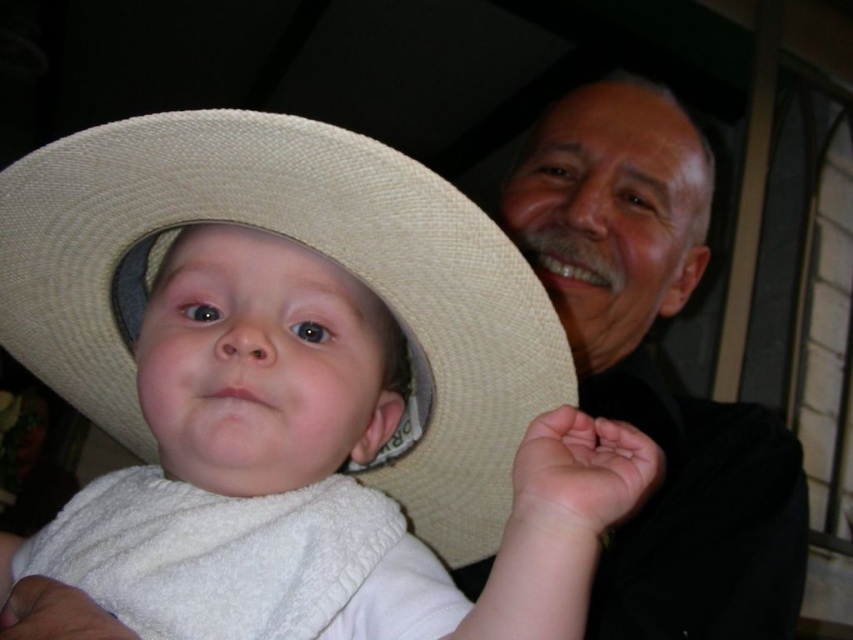
You are a photographer setting up a photo shoot. You have a beige straw cowboy hat at center and a smooth black shirt at upper right in the frame. Which item should you adjust if you want to ensure the wider object is positioned centrally?

The beige straw cowboy hat at center is wider than the smooth black shirt at upper right, so you should adjust the smooth black shirt at upper right to ensure the wider object is positioned centrally.

You are a photographer taking a picture of the beige straw cowboy hat at center and the smooth black shirt at upper right. Which object should you adjust your camera focus on first if you want to capture both clearly?

The beige straw cowboy hat at center is to the left of the smooth black shirt at upper right. Since the hat is closer to the foreground, you should focus on the hat first to ensure both are in focus as you adjust the camera.

You are holding a camera and want to take a photo of the scene. The camera is currently at point with coordinates point (519,259). To ensure the entire scene is captured, should you move the camera closer or farther away?

The point (519,259) and camera are 16.19 inches apart from each other. To ensure the entire scene is captured, you should move the camera farther away so that more of the scene can be included in the frame.